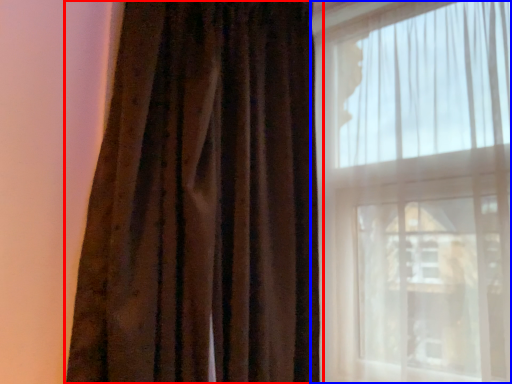
Question: Which object appears closest to the camera in this image, curtain (highlighted by a red box) or window (highlighted by a blue box)?

Choices:
 (A) curtain
 (B) window

Answer: (A)